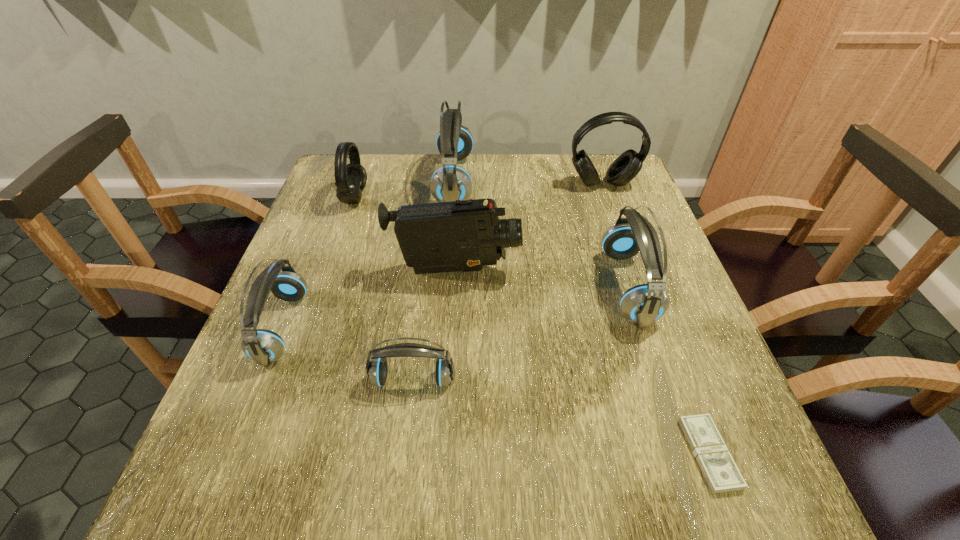
In order to click on the farthest blue headset in this screenshot , I will do `click(454, 142)`.

The image size is (960, 540). What are the coordinates of `the bigger gray headset` in the screenshot? It's located at (625, 167).

At what (x,y) coordinates should I click in order to perform the action: click on camcorder. Please return your answer as a coordinate pair (x, y). The height and width of the screenshot is (540, 960). Looking at the image, I should click on (454, 236).

Identify the location of the second biggest blue headset. (645, 303).

Identify the location of the left gray headset. (350, 179).

The width and height of the screenshot is (960, 540). I want to click on the leftmost blue headset, so click(263, 346).

Locate an element on the screen. The image size is (960, 540). the second shortest object is located at coordinates (377, 370).

Locate an element on the screen. The image size is (960, 540). the smallest blue headset is located at coordinates (377, 370).

I want to click on the nearest object, so click(722, 475).

Where is `money`? money is located at coordinates (722, 475).